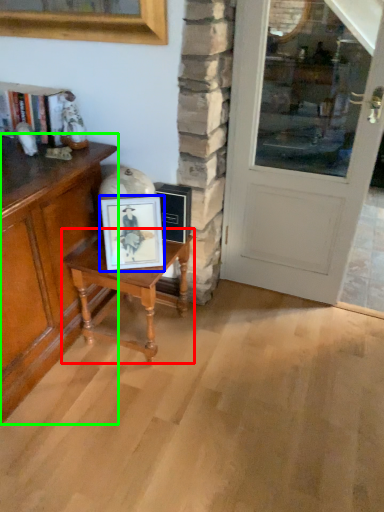
Question: Which is nearer to the table (highlighted by a red box)? picture frame (highlighted by a blue box) or cabinetry (highlighted by a green box).

Choices:
 (A) picture frame
 (B) cabinetry

Answer: (A)